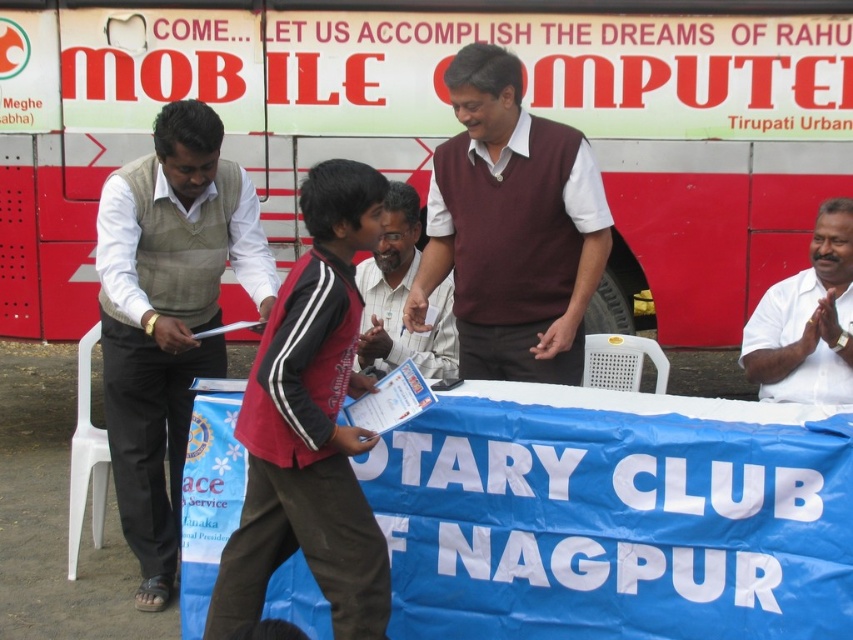
You are a photographer at the event and need to capture a photo of the red painted bus at upper center and the dark red jacket at center. Which object should you focus on first if you want to include both in the frame without moving the camera?

The red painted bus at upper center is bigger than the dark red jacket at center, so you should focus on the dark red jacket at center first to ensure it fits within the frame before adjusting for the larger bus.